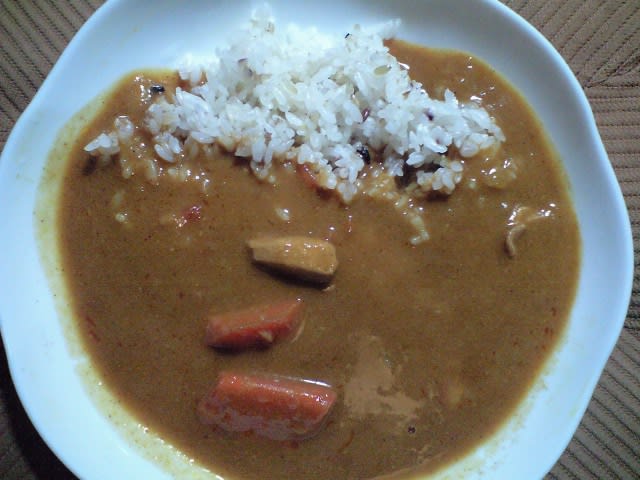
Where is `part of placemat`? Image resolution: width=640 pixels, height=480 pixels. part of placemat is located at coordinates (621, 423).